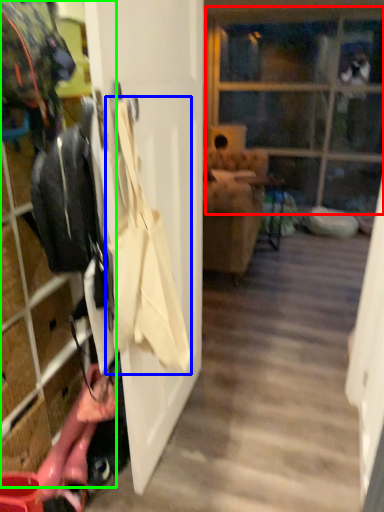
Question: Which object is positioned closest to glass door (highlighted by a red box)? Select from shoulder bag (highlighted by a blue box) and closet (highlighted by a green box).

Choices:
 (A) shoulder bag
 (B) closet

Answer: (B)